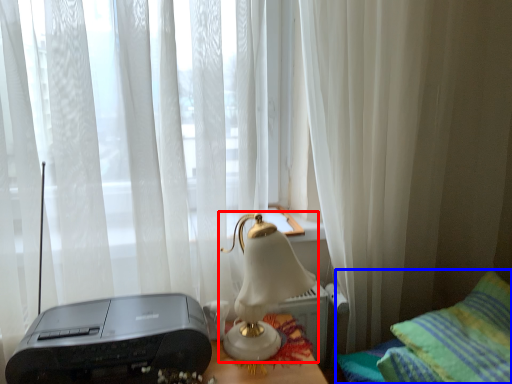
Question: Among these objects, which one is farthest to the camera, lamp (highlighted by a red box) or furniture (highlighted by a blue box)?

Choices:
 (A) lamp
 (B) furniture

Answer: (A)